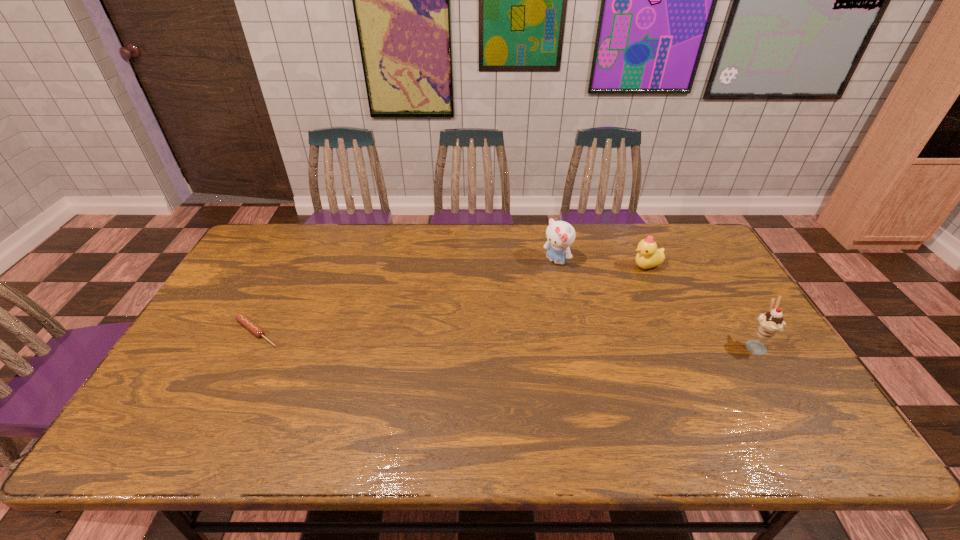
Locate an element on the screen. This screenshot has height=540, width=960. the leftmost object is located at coordinates (242, 319).

This screenshot has width=960, height=540. Find the location of `sausage`. sausage is located at coordinates (242, 319).

Where is `icecream`? The height and width of the screenshot is (540, 960). icecream is located at coordinates (772, 322).

Locate an element on the screen. kitten is located at coordinates (560, 235).

This screenshot has height=540, width=960. What are the coordinates of `duckling` in the screenshot? It's located at (648, 256).

You are a GUI agent. You are given a task and a screenshot of the screen. Output one action in this format:
    pyautogui.click(x=<x>, y=<y>)
    Task: Click on the third tallest object
    
    Given the screenshot: What is the action you would take?
    pyautogui.click(x=648, y=256)

Identify the location of blank space located 0.060m on the left of the sausage. This screenshot has height=540, width=960. (209, 333).

Find the location of `vacant region located 0.180m on the left of the rightmost object`. vacant region located 0.180m on the left of the rightmost object is located at coordinates (676, 345).

What are the coordinates of `vacant space located on the front-facing side of the second object from left to right` in the screenshot? It's located at (528, 285).

In order to click on vacant space located 0.080m on the front-facing side of the second object from left to right in this screenshot , I will do `click(532, 282)`.